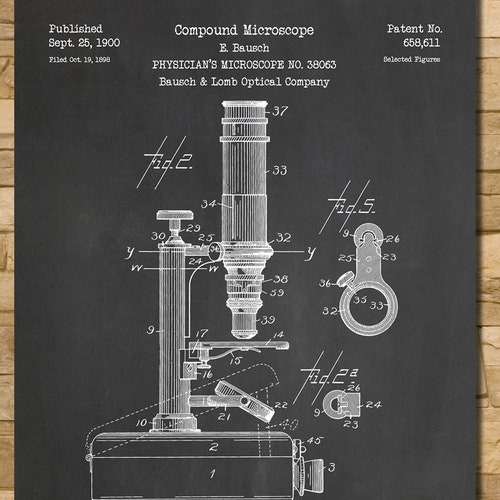
Where is `wood table`? This screenshot has height=500, width=500. wood table is located at coordinates (486, 246).